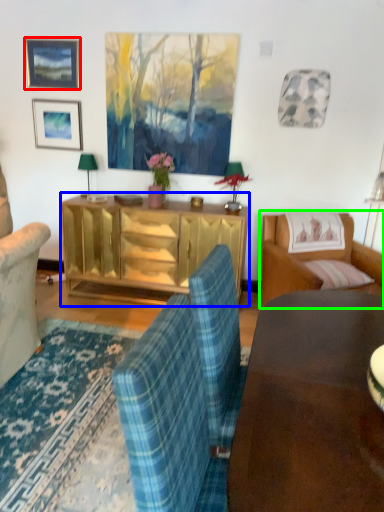
Question: Considering the real-world distances, which object is closest to picture frame (highlighted by a red box)? cabinetry (highlighted by a blue box) or studio couch (highlighted by a green box).

Choices:
 (A) cabinetry
 (B) studio couch

Answer: (A)